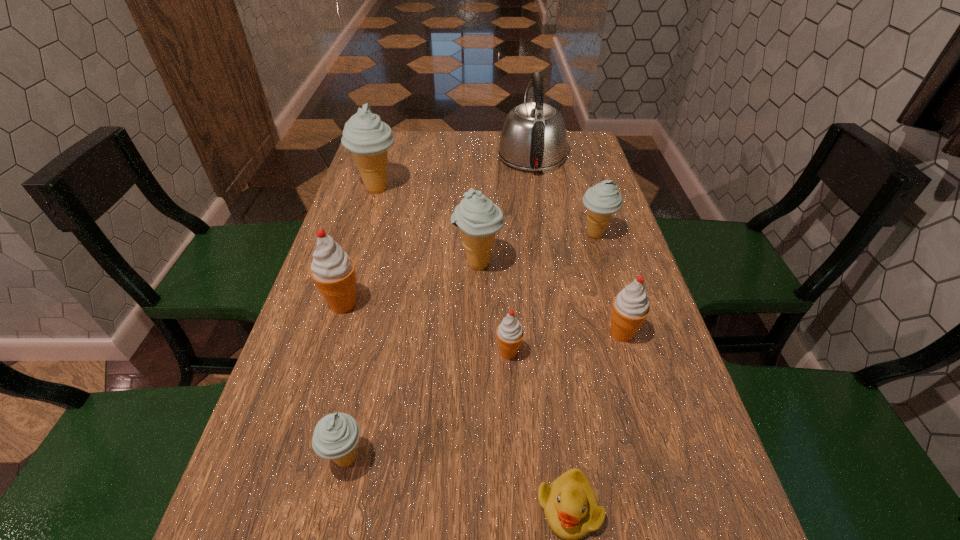
Locate an element on the screen. The height and width of the screenshot is (540, 960). vacant region between the nearest beige icecream and the kettle is located at coordinates (439, 307).

Find the location of `empty space between the fifth nearest object and the smallest red icecream`. empty space between the fifth nearest object and the smallest red icecream is located at coordinates (426, 328).

Locate an element on the screen. The height and width of the screenshot is (540, 960). free point between the third biggest beige icecream and the fifth nearest icecream is located at coordinates (537, 249).

This screenshot has width=960, height=540. I want to click on object identified as the fifth closest to the farthest icecream, so click(x=510, y=333).

Identify the location of the fourth closest object to the second red icecream from left to right. (336, 435).

Point out which icecream is positioned as the nearest to the second smallest red icecream. Please provide its 2D coordinates. Your answer should be formatted as a tuple, i.e. [(x, y)], where the tuple contains the x and y coordinates of a point satisfying the conditions above.

[(510, 333)]

Locate an element on the screen. The image size is (960, 540). icecream that is the seventh closest to the gray kettle is located at coordinates (336, 435).

You are a GUI agent. You are given a task and a screenshot of the screen. Output one action in this format:
    pyautogui.click(x=<x>, y=<y>)
    Task: Click on the beige icecream that stands as the third closest to the nearest beige icecream
    
    Given the screenshot: What is the action you would take?
    pyautogui.click(x=368, y=138)

Where is `beige icecream that is the closest to the second biggest beige icecream`? The image size is (960, 540). beige icecream that is the closest to the second biggest beige icecream is located at coordinates (602, 200).

Image resolution: width=960 pixels, height=540 pixels. I want to click on red icecream that is the closest to the shortest object, so click(510, 333).